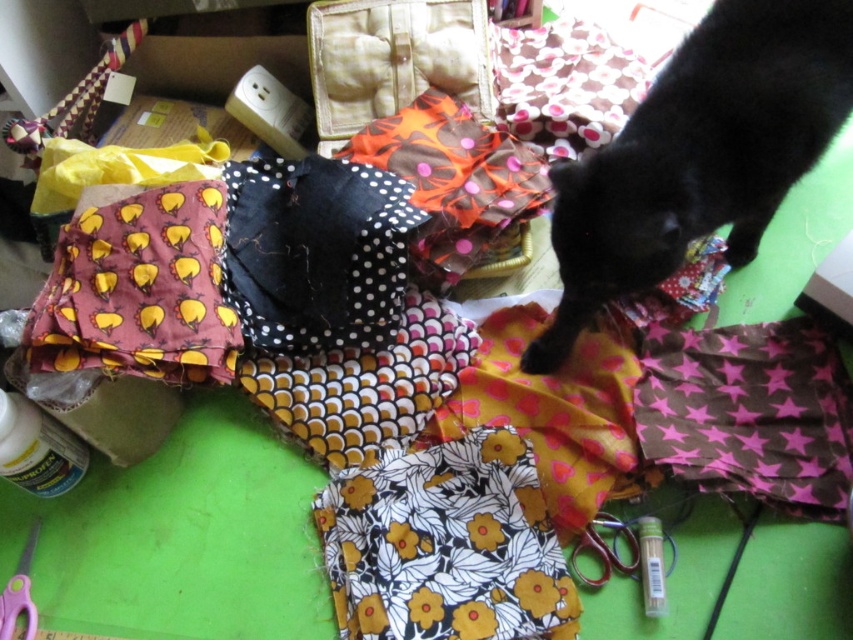
Looking at this image, who is more distant from viewer, (601,186) or (268,259)?

Point (268,259)

Consider the image. Which is above, black fur cat at upper right or black dotted fabric at center?

black fur cat at upper right is higher up.

This screenshot has width=853, height=640. I want to click on black fur cat at upper right, so click(698, 156).

Locate an element on the screen. black fur cat at upper right is located at coordinates (698, 156).

Who is shorter, black dotted fabric at center or pink plastic scissors at lower left?

With less height is pink plastic scissors at lower left.

Which is in front, point (370, 273) or point (22, 589)?

Point (22, 589)

Is point (370, 273) positioned before point (15, 612)?

No, (370, 273) is behind (15, 612).

The image size is (853, 640). I want to click on black dotted fabric at center, so click(316, 252).

Which is above, brown star-patterned fabric at lower right or metallic silver scissors at lower right?

brown star-patterned fabric at lower right is above.

Which is below, brown star-patterned fabric at lower right or metallic silver scissors at lower right?

metallic silver scissors at lower right

Find the location of a particular element. The image size is (853, 640). brown star-patterned fabric at lower right is located at coordinates (749, 412).